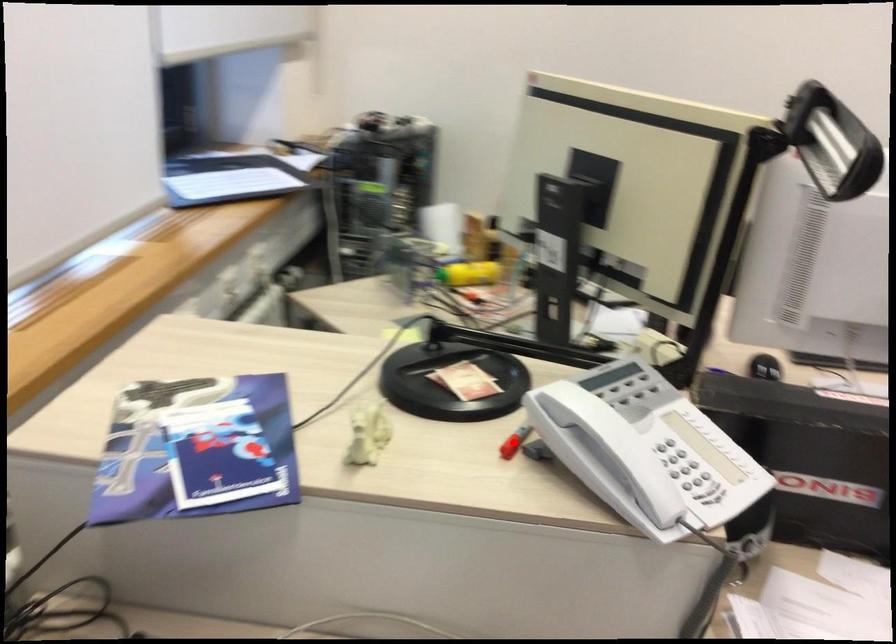
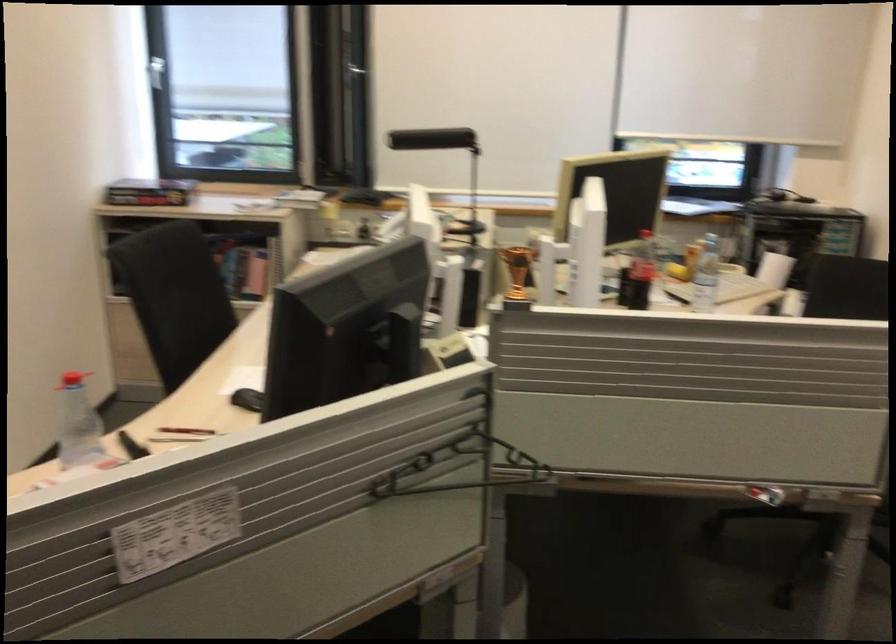
Question: I am providing you with two images of the same scene from different viewpoints. A red point is marked on the first image. At the location where the point appears in image 1, is it still visible in image 2?

Choices:
 (A) Yes
 (B) No

Answer: (B)